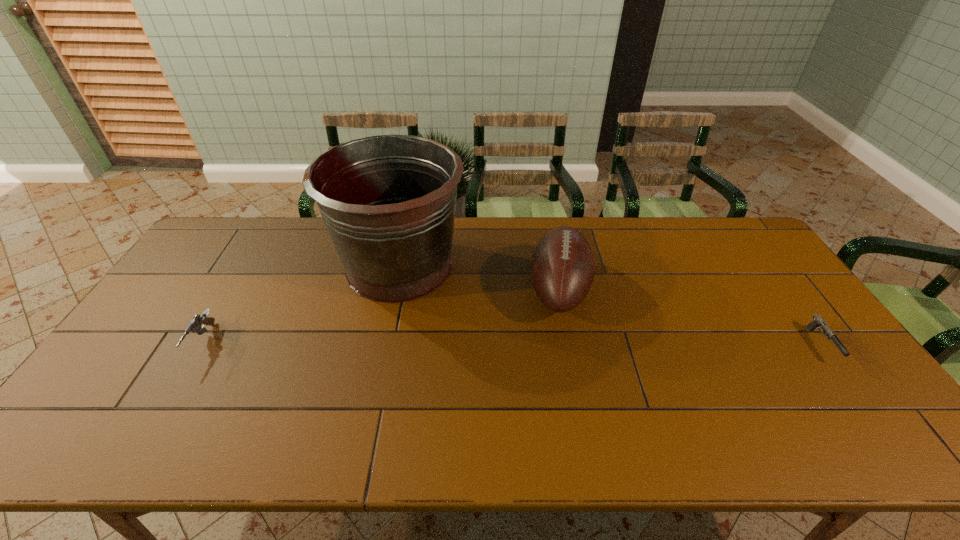
At what (x,y) coordinates should I click in order to perform the action: click on object that ranks as the third closest to the second object from right to left. Please return your answer as a coordinate pair (x, y). This screenshot has width=960, height=540. Looking at the image, I should click on (195, 325).